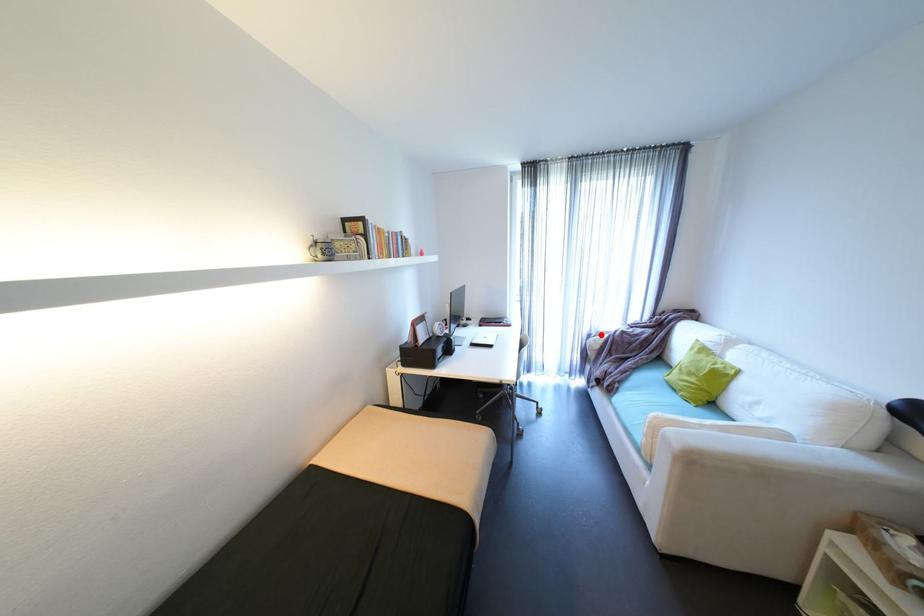
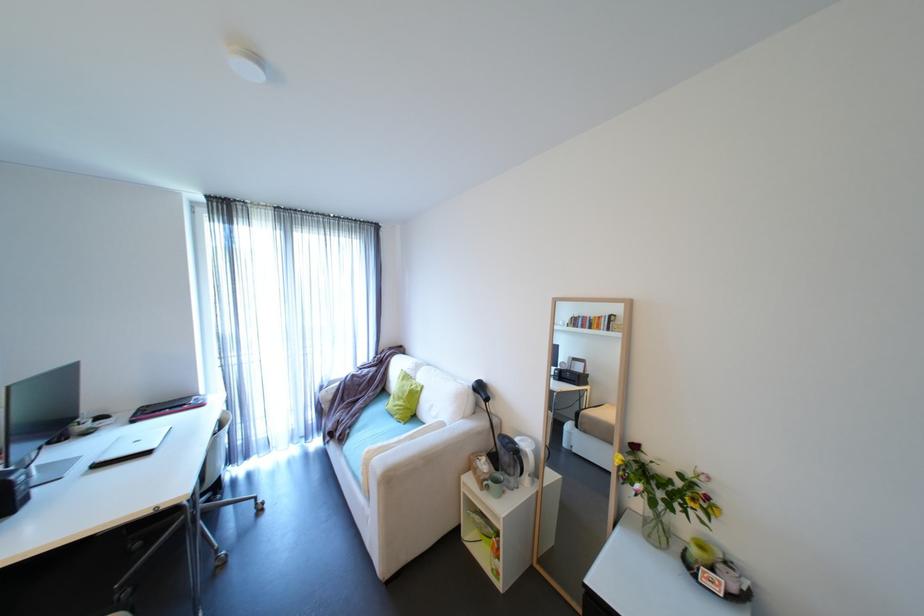
Question: I am providing you with two images of the same scene from different viewpoints. Image1 has a red point marked. In image2, the corresponding 3D location appears at what relative position? Reply with the corresponding letter.

Choices:
 (A) Closer
 (B) Farther

Answer: (B)